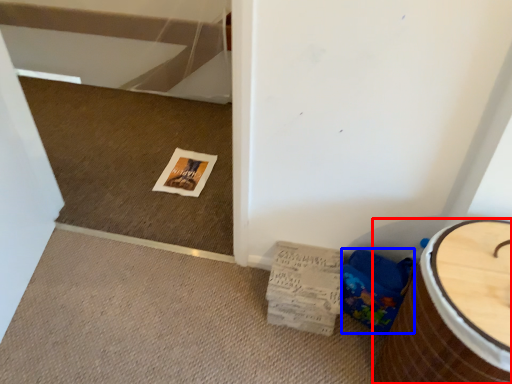
Question: Which point is closer to the camera, furniture (highlighted by a red box) or potty (highlighted by a blue box)?

Choices:
 (A) furniture
 (B) potty

Answer: (A)